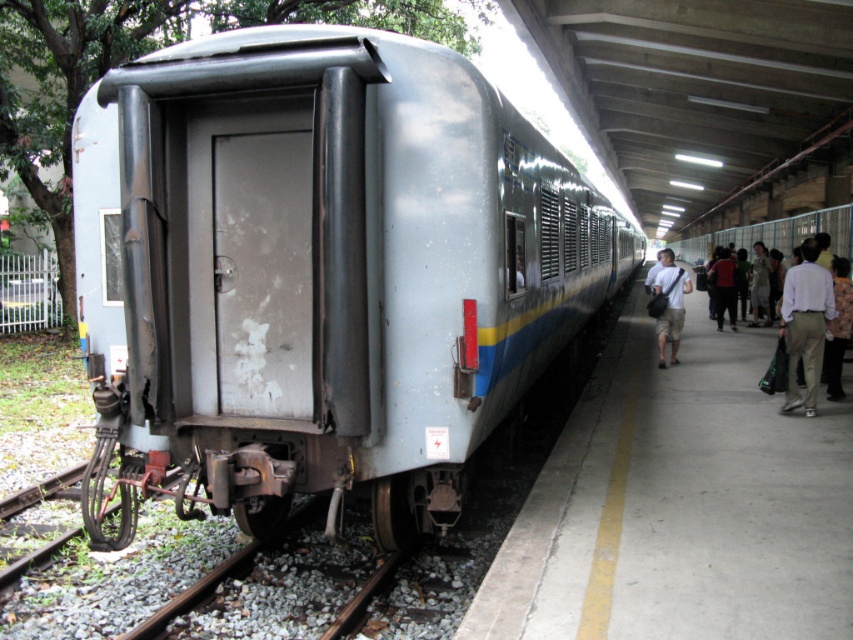
Question: In this image, where is matte gray train at center located relative to white shirt at right?

Choices:
 (A) right
 (B) left

Answer: (B)

Question: Is dark gray fabric pants at center-right below light brown fabric shirt at right?

Choices:
 (A) no
 (B) yes

Answer: (A)

Question: Does matte gray train at center have a larger size compared to white shirt at right?

Choices:
 (A) no
 (B) yes

Answer: (B)

Question: Among these points, which one is nearest to the camera?

Choices:
 (A) [218, 360]
 (B) [718, 307]
 (C) [671, 355]
 (D) [764, 259]

Answer: (A)

Question: Which point is closer to the camera taking this photo?

Choices:
 (A) (231, 93)
 (B) (821, 285)

Answer: (A)

Question: Considering the real-world distances, which object is closest to the white shirt at right?

Choices:
 (A) matte gray train at center
 (B) light brown fabric shirt at right

Answer: (A)